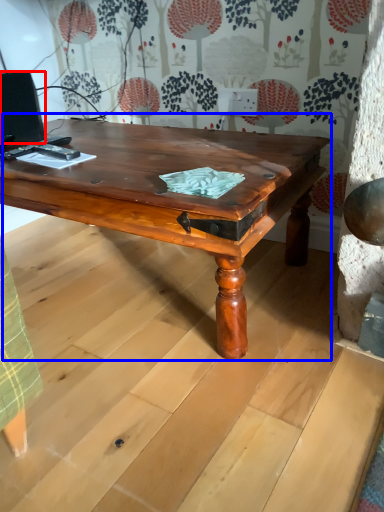
Question: Which object appears closest to the camera in this image, computer monitor (highlighted by a red box) or coffee table (highlighted by a blue box)?

Choices:
 (A) computer monitor
 (B) coffee table

Answer: (B)